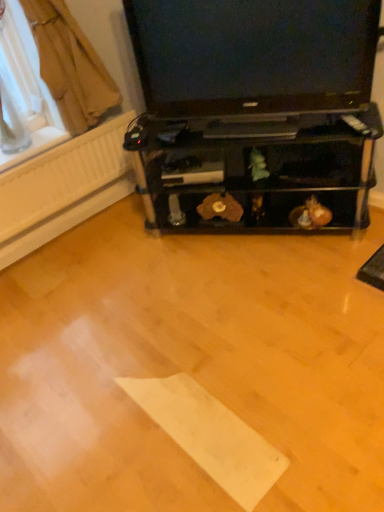
Question: From the image's perspective, does transparent plastic window screen at upper left appear lower than black glossy television at upper center?

Choices:
 (A) no
 (B) yes

Answer: (A)

Question: Is transparent plastic window screen at upper left next to black glossy television at upper center and touching it?

Choices:
 (A) no
 (B) yes

Answer: (A)

Question: Does transparent plastic window screen at upper left lie behind black glossy television at upper center?

Choices:
 (A) no
 (B) yes

Answer: (B)

Question: Is black glossy television at upper center a part of transparent plastic window screen at upper left?

Choices:
 (A) yes
 (B) no

Answer: (B)

Question: From the image's perspective, is transparent plastic window screen at upper left on top of black glossy television at upper center?

Choices:
 (A) no
 (B) yes

Answer: (B)

Question: Is point (77, 38) closer or farther from the camera than point (162, 54)?

Choices:
 (A) closer
 (B) farther

Answer: (B)

Question: From a real-world perspective, is brown fabric curtain at upper left physically located above or below black glossy television at upper center?

Choices:
 (A) above
 (B) below

Answer: (A)

Question: In terms of width, does brown fabric curtain at upper left look wider or thinner when compared to black glossy television at upper center?

Choices:
 (A) thin
 (B) wide

Answer: (B)

Question: Is brown fabric curtain at upper left inside or outside of black glossy television at upper center?

Choices:
 (A) inside
 (B) outside

Answer: (B)

Question: From the image's perspective, is transparent plastic window screen at upper left positioned above or below brown fabric curtain at upper left?

Choices:
 (A) above
 (B) below

Answer: (B)

Question: Considering the positions of transparent plastic window screen at upper left and brown fabric curtain at upper left in the image, is transparent plastic window screen at upper left taller or shorter than brown fabric curtain at upper left?

Choices:
 (A) short
 (B) tall

Answer: (A)

Question: Considering the relative positions of transparent plastic window screen at upper left and brown fabric curtain at upper left in the image provided, is transparent plastic window screen at upper left to the left or to the right of brown fabric curtain at upper left?

Choices:
 (A) right
 (B) left

Answer: (B)

Question: In terms of width, does transparent plastic window screen at upper left look wider or thinner when compared to brown fabric curtain at upper left?

Choices:
 (A) wide
 (B) thin

Answer: (A)

Question: Is black glossy television at upper center inside or outside of transparent plastic window screen at upper left?

Choices:
 (A) outside
 (B) inside

Answer: (A)

Question: From a real-world perspective, is black glossy television at upper center positioned above or below transparent plastic window screen at upper left?

Choices:
 (A) above
 (B) below

Answer: (B)